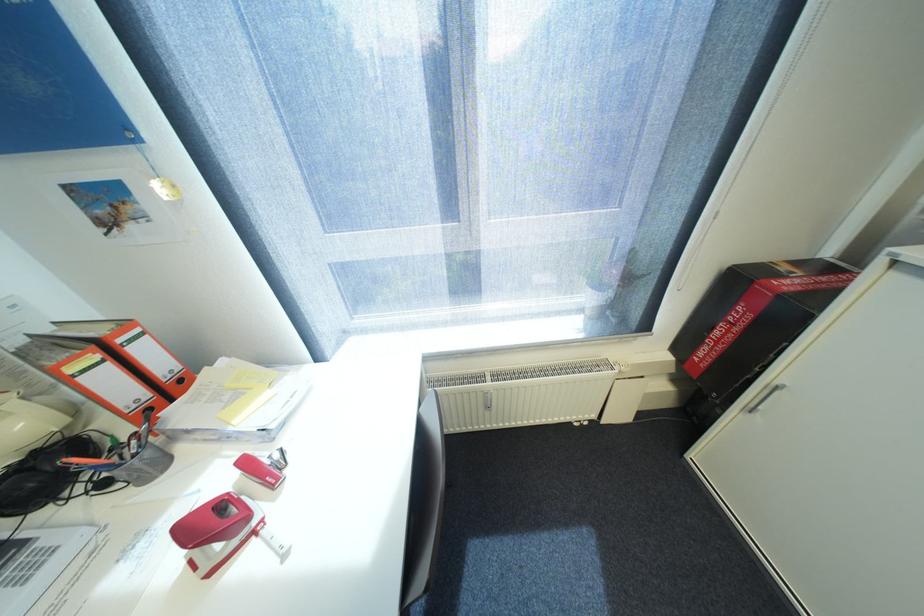
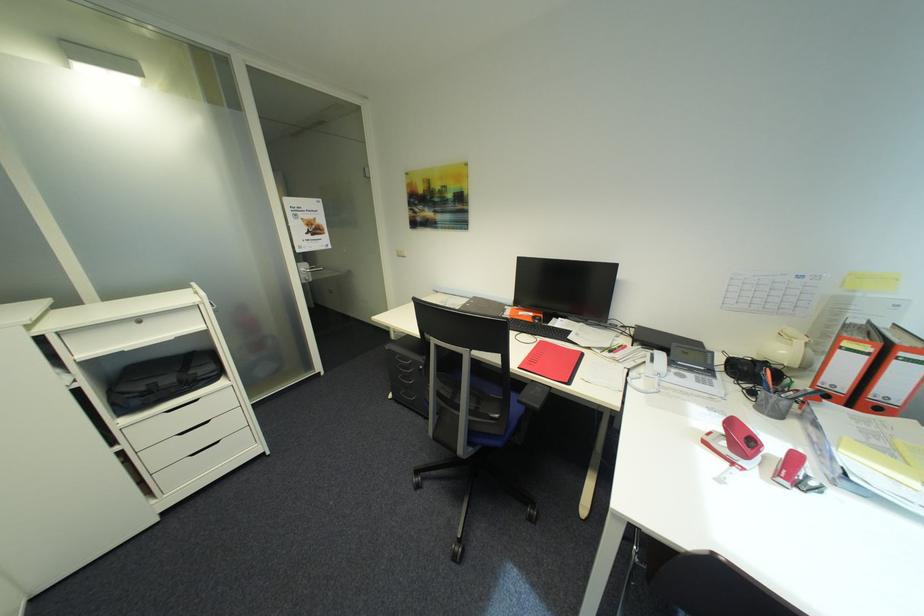
Question: I am providing you with two images of the same scene from different viewpoints. Which of the following objects are not visible in image2?

Choices:
 (A) black laptop bag
 (B) white drawer handle
 (C) red notebook
 (D) none of these

Answer: (D)